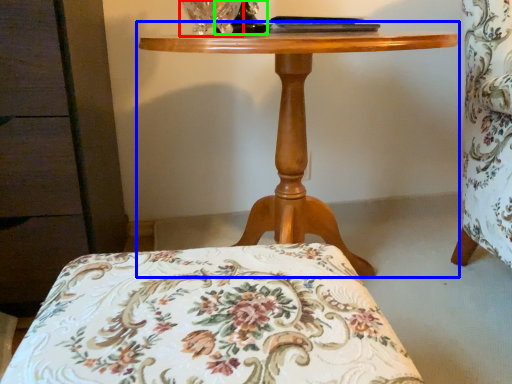
Question: Based on their relative distances, which object is farther from glass vase (highlighted by a red box)? Choose from table (highlighted by a blue box) and table lamp (highlighted by a green box).

Choices:
 (A) table
 (B) table lamp

Answer: (A)